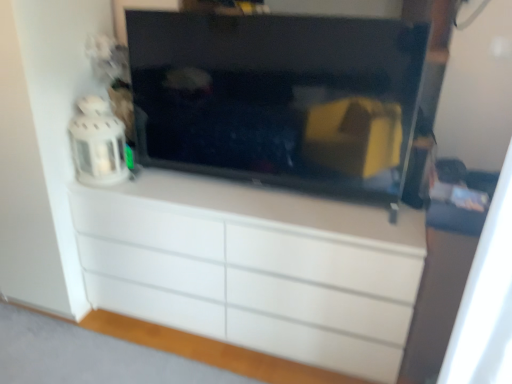
Question: From the image's perspective, is white glossy chest of drawers at center above or below black glossy tv at center?

Choices:
 (A) above
 (B) below

Answer: (B)

Question: In terms of width, does white glossy chest of drawers at center look wider or thinner when compared to black glossy tv at center?

Choices:
 (A) wide
 (B) thin

Answer: (A)

Question: Which of these objects is positioned closest to the white glossy chest of drawers at center?

Choices:
 (A) black glossy tv at center
 (B) white fabric curtain at right

Answer: (A)

Question: Which is farther from the white glossy chest of drawers at center?

Choices:
 (A) white fabric curtain at right
 (B) black glossy tv at center

Answer: (A)